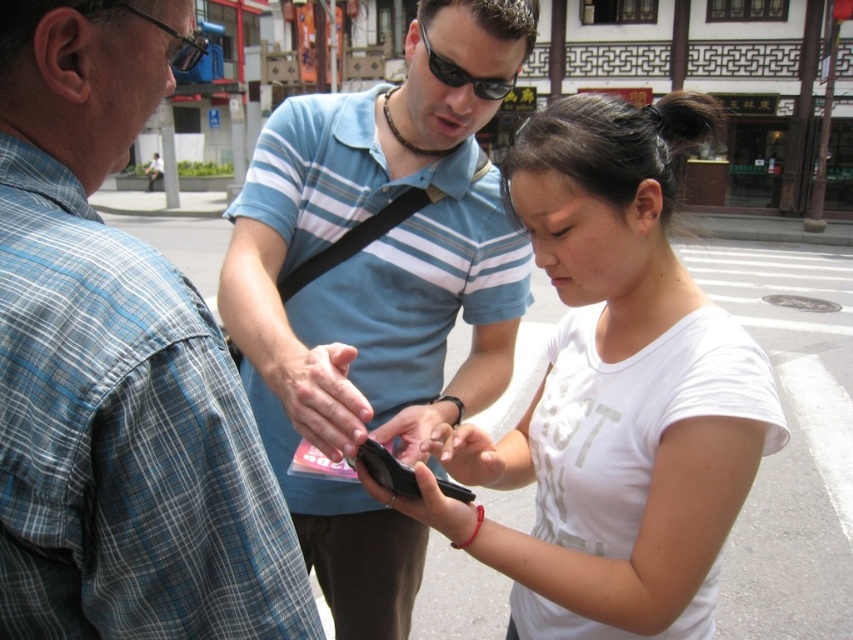
Question: Which point is closer to the camera?

Choices:
 (A) (71, 384)
 (B) (178, 42)
 (C) (373, 470)
 (D) (473, 80)

Answer: (A)

Question: Does blue striped shirt at center appear on the right side of black matte smartphone at center?

Choices:
 (A) no
 (B) yes

Answer: (A)

Question: Is white matte shirt at center above black matte smartphone at center?

Choices:
 (A) no
 (B) yes

Answer: (B)

Question: Is blue plaid shirt at left smaller than black matte smartphone at center?

Choices:
 (A) yes
 (B) no

Answer: (B)

Question: Which point is farther from the camera taking this photo?

Choices:
 (A) (440, 488)
 (B) (135, 435)

Answer: (A)

Question: Among these objects, which one is nearest to the camera?

Choices:
 (A) black matte smartphone at center
 (B) blue plaid shirt at left

Answer: (B)